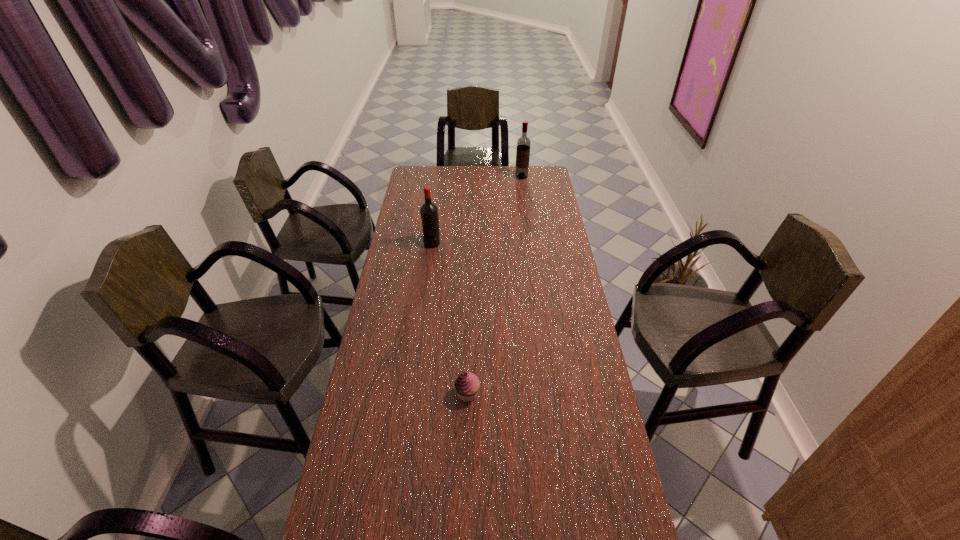
At what (x,y) coordinates should I click in order to perform the action: click on free space that is in between the farthest object and the second farthest object. Please return your answer as a coordinate pair (x, y). Looking at the image, I should click on (477, 210).

The width and height of the screenshot is (960, 540). In order to click on object identified as the second closest to the farther wine bottle in this screenshot , I will do `click(467, 385)`.

Identify the location of object that is the closest to the second farthest object. (523, 143).

Where is `vacant space that satisfies the following two spatial constraints: 1. on the back side of the farther wine bottle; 2. on the left side of the leftmost object`? vacant space that satisfies the following two spatial constraints: 1. on the back side of the farther wine bottle; 2. on the left side of the leftmost object is located at coordinates 441,177.